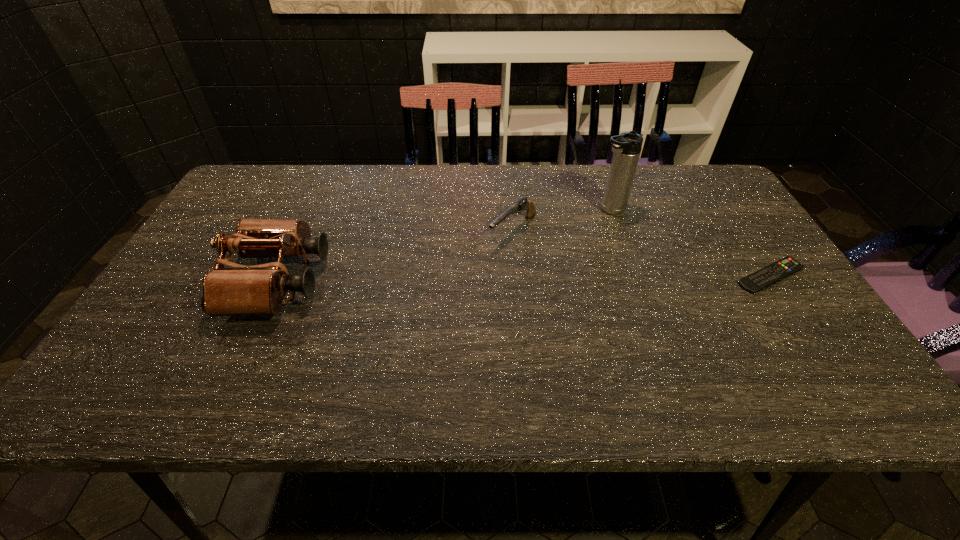
Image resolution: width=960 pixels, height=540 pixels. I want to click on binoculars, so click(x=257, y=290).

Where is `the third shortest object`? the third shortest object is located at coordinates (257, 290).

Where is `the rightmost object`? the rightmost object is located at coordinates (779, 270).

Where is `the shortest object`? the shortest object is located at coordinates (779, 270).

Where is `the tallest object`? This screenshot has height=540, width=960. the tallest object is located at coordinates (627, 146).

The width and height of the screenshot is (960, 540). I want to click on thermos bottle, so click(627, 146).

At what (x,y) coordinates should I click in order to perform the action: click on gun. Please return your answer as a coordinate pair (x, y). The height and width of the screenshot is (540, 960). Looking at the image, I should click on (522, 204).

Locate an element on the screen. the third object from right to left is located at coordinates (522, 204).

Find the location of a particular element. vacant space positioned 0.070m through the eyepieces of the leftmost object is located at coordinates (351, 281).

Locate an element on the screen. The height and width of the screenshot is (540, 960). vacant space situated 0.340m on the left of the remote control is located at coordinates (597, 276).